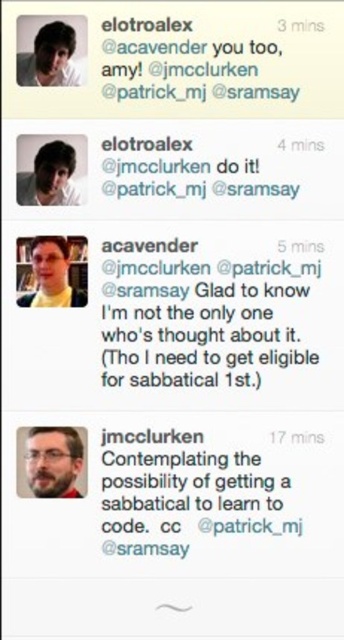
Question: Does black matte tweet at upper center have a smaller size compared to matte black hair at upper left?

Choices:
 (A) no
 (B) yes

Answer: (A)

Question: Which point is closer to the camera taking this photo?

Choices:
 (A) (153, 445)
 (B) (213, 266)
 (C) (49, 492)

Answer: (C)

Question: Can you confirm if white matte tweet at center is positioned to the right of black matte tweet at upper center?

Choices:
 (A) no
 (B) yes

Answer: (B)

Question: Which of the following is the farthest from the observer?

Choices:
 (A) (31, 80)
 (B) (129, 298)
 (C) (40, 244)
 (D) (45, 179)

Answer: (B)

Question: Can you confirm if white matte tweet at center is bigger than bearded man at center?

Choices:
 (A) no
 (B) yes

Answer: (B)

Question: Which point is farther to the camera?

Choices:
 (A) yellow fabric shirt at upper left
 (B) matte black hair at upper left
 (C) black matte tweet at upper center
 (D) black matte text at center

Answer: (A)